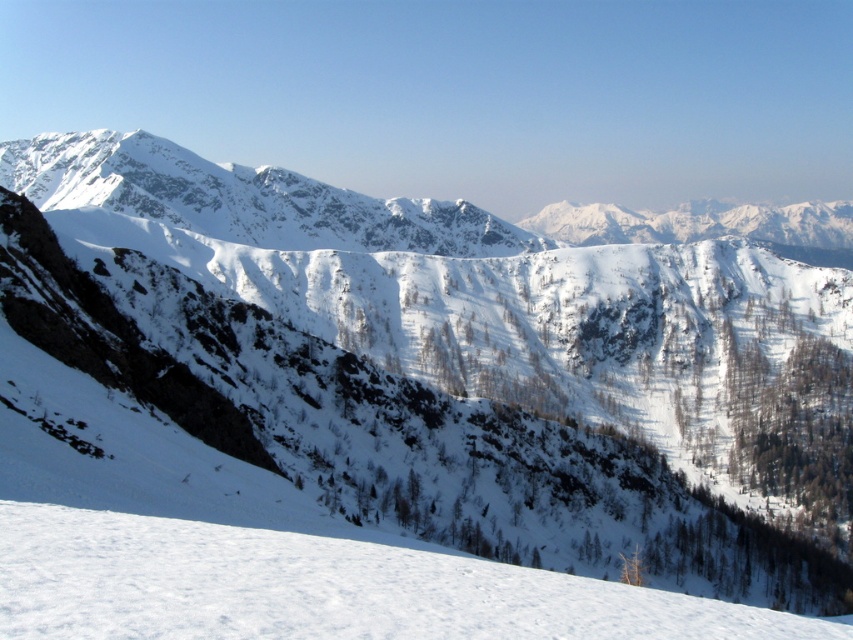
Does white snow at lower center appear on the right side of white snow-covered mountain range at upper center?

Incorrect, white snow at lower center is not on the right side of white snow-covered mountain range at upper center.

Which is above, white snow at lower center or white snow-covered mountain range at upper center?

white snow-covered mountain range at upper center

Is point (762, 614) closer to viewer compared to point (178, 193)?

Yes, it is in front of point (178, 193).

Identify the location of white snow at lower center. The height and width of the screenshot is (640, 853). (318, 588).